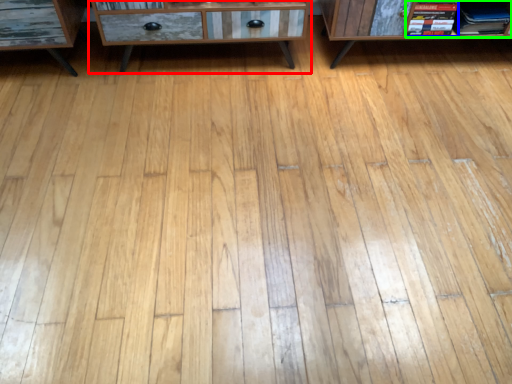
Question: Based on their relative distances, which object is farther from chest of drawers (highlighted by a red box)? Choose from book (highlighted by a blue box) and book (highlighted by a green box).

Choices:
 (A) book
 (B) book

Answer: (B)